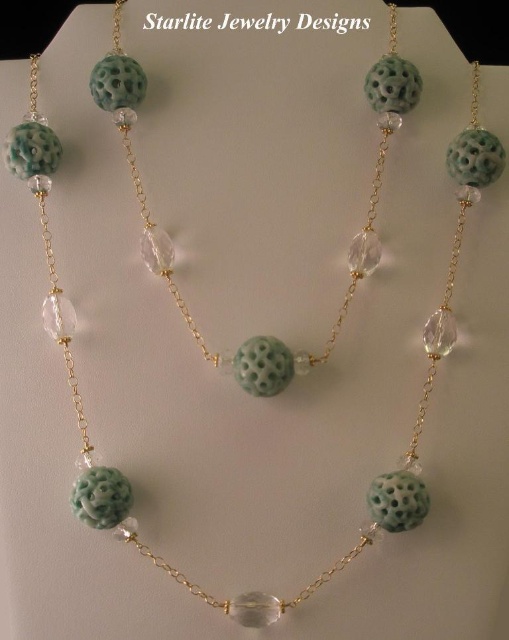
Question: Can you confirm if matte green stone at center is positioned to the left of green carved stone at center?

Choices:
 (A) no
 (B) yes

Answer: (B)

Question: Which point is closer to the camera?

Choices:
 (A) matte green stone at center
 (B) green carved stone at center

Answer: (B)

Question: Considering the relative positions of matte green stone at center and green carved stone at center in the image provided, where is matte green stone at center located with respect to green carved stone at center?

Choices:
 (A) left
 (B) right

Answer: (A)

Question: Does matte green stone at center have a smaller size compared to green carved stone at center?

Choices:
 (A) no
 (B) yes

Answer: (A)

Question: Which of the following is the farthest from the observer?

Choices:
 (A) (407, 525)
 (B) (379, 102)

Answer: (B)